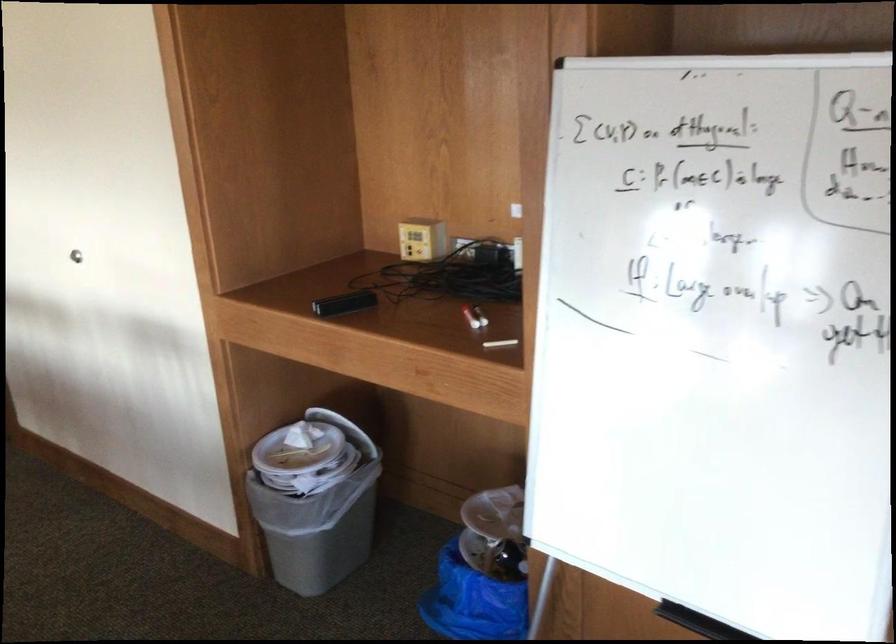
Find where to lift the blue trash bag. Please return your answer as a coordinate pair (x, y).

(472, 601)